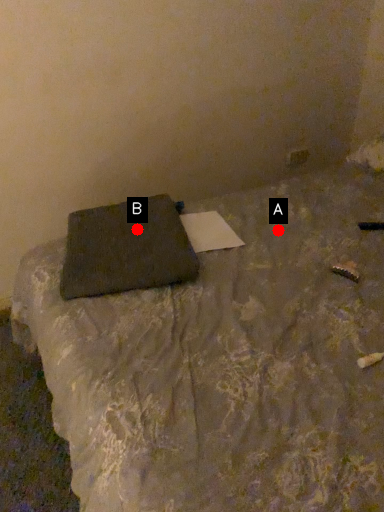
Question: Two points are circled on the image, labeled by A and B beside each circle. Which of the following is the closest to the observer?

Choices:
 (A) A is closer
 (B) B is closer

Answer: (B)